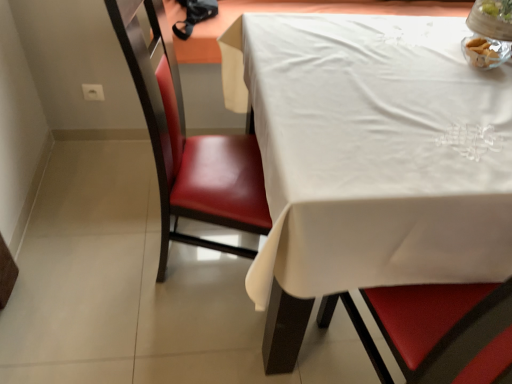
The image size is (512, 384). I want to click on free space in front of leather at left, so click(x=197, y=339).